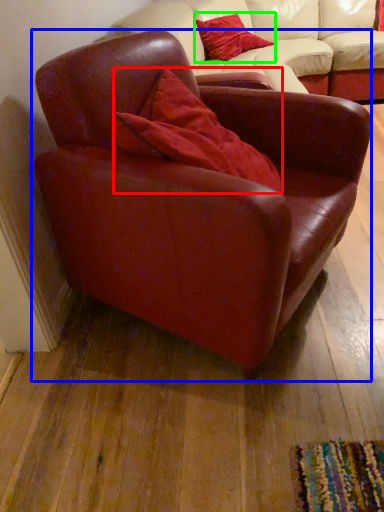
Question: Which is farther away from pillow (highlighted by a red box)? chair (highlighted by a blue box) or pillow (highlighted by a green box)?

Choices:
 (A) chair
 (B) pillow

Answer: (B)